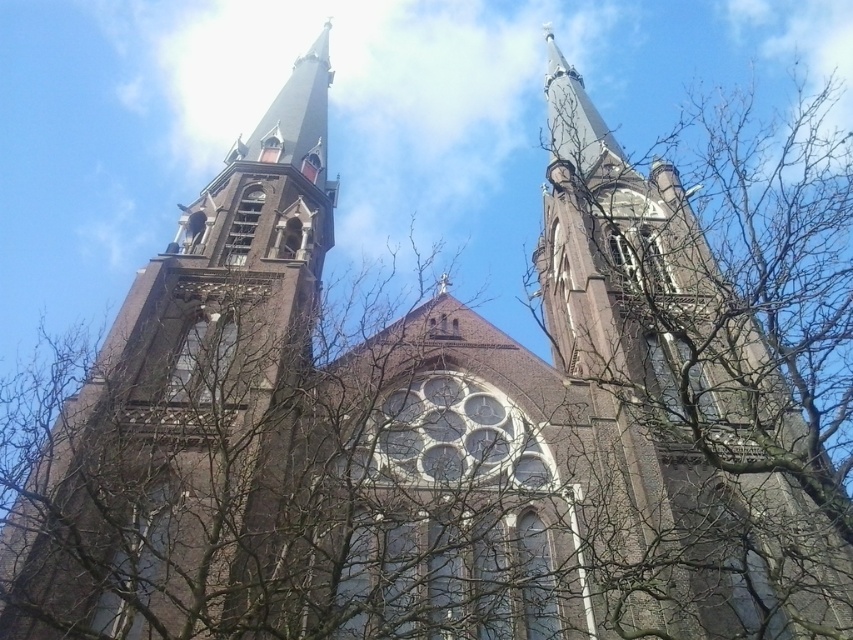
Does point (229, 396) come farther from viewer compared to point (679, 525)?

Yes.

The width and height of the screenshot is (853, 640). I want to click on brown brick tower at upper left, so click(189, 410).